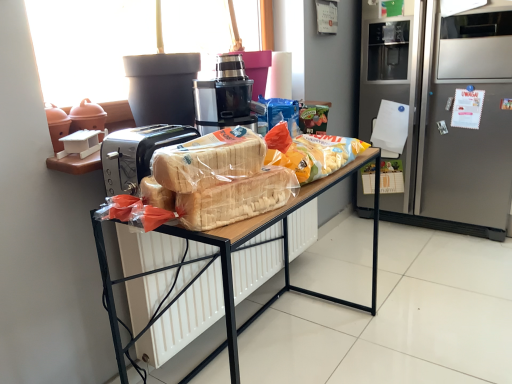
Where is `blank space above translucent plastic bread at center, the 1th snack viewed from the front (from a real-world perspective)`? The image size is (512, 384). blank space above translucent plastic bread at center, the 1th snack viewed from the front (from a real-world perspective) is located at coordinates (219, 178).